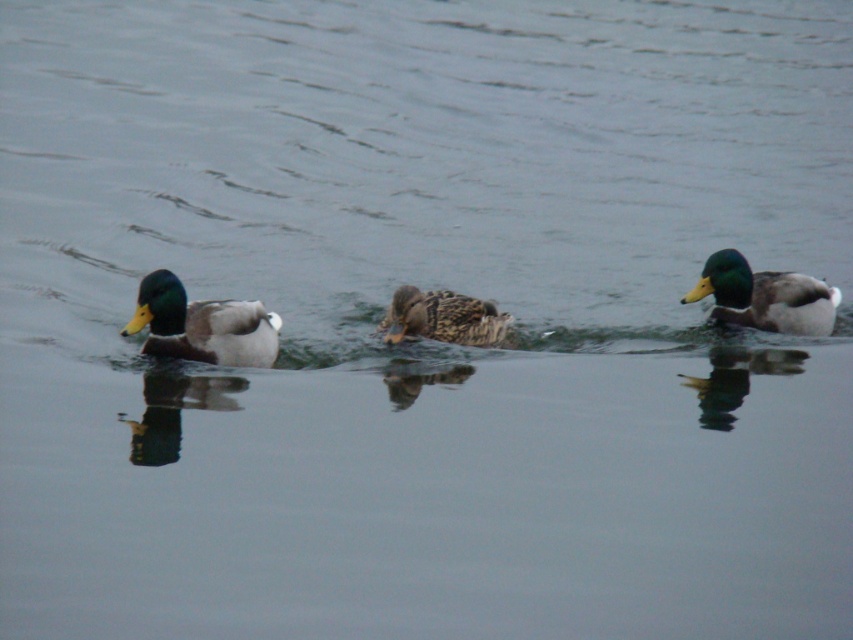
You are standing on the lakeside and see the green glossy duck at right and the brown speckled duck at center. Which duck appears closer to you?

The green glossy duck at right appears closer to you because the brown speckled duck at center is behind it.

You are a birdwatcher observing the ducks. You notice the green glossy duck at right and the brown speckled duck at center. Which duck has a greater height?

The green glossy duck at right is much taller than the brown speckled duck at center.